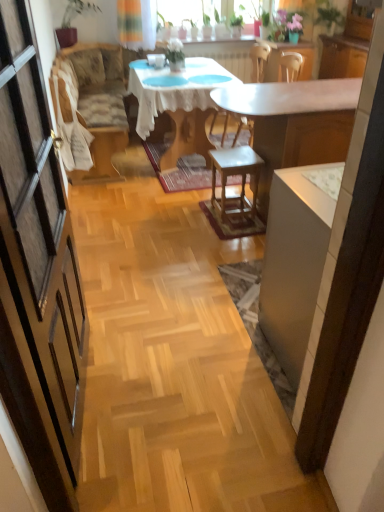
Locate an element on the screen. This screenshot has width=384, height=512. free space to the left of wooden stool at center is located at coordinates (192, 210).